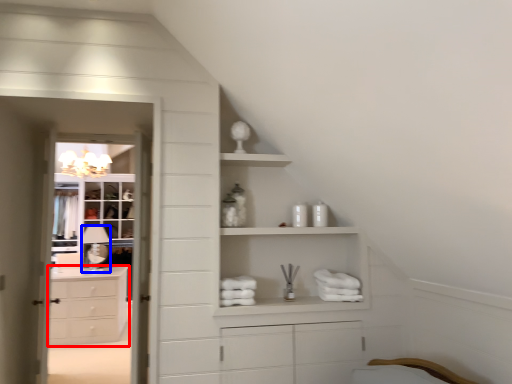
Question: Which of the following is the closest to the observer, chest of drawers (highlighted by a red box) or lamp (highlighted by a blue box)?

Choices:
 (A) chest of drawers
 (B) lamp

Answer: (A)